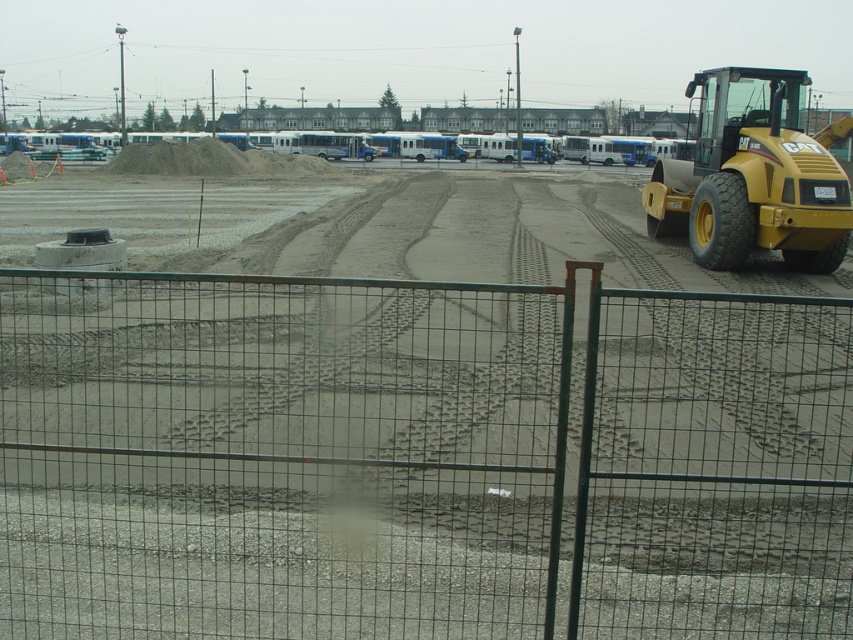
Question: Can you confirm if green wire mesh fence at center is positioned above yellow rubber tractor at right?

Choices:
 (A) no
 (B) yes

Answer: (A)

Question: Is green wire mesh fence at center bigger than yellow rubber tractor at right?

Choices:
 (A) no
 (B) yes

Answer: (B)

Question: Which point is farther from the camera taking this photo?

Choices:
 (A) (837, 528)
 (B) (822, 186)

Answer: (B)

Question: Is green wire mesh fence at center to the right of yellow rubber tractor at right from the viewer's perspective?

Choices:
 (A) no
 (B) yes

Answer: (A)

Question: Among these points, which one is nearest to the camera?

Choices:
 (A) (47, 538)
 (B) (666, 204)

Answer: (A)

Question: Which object is closer to the camera taking this photo?

Choices:
 (A) yellow rubber tractor at right
 (B) green wire mesh fence at center

Answer: (B)